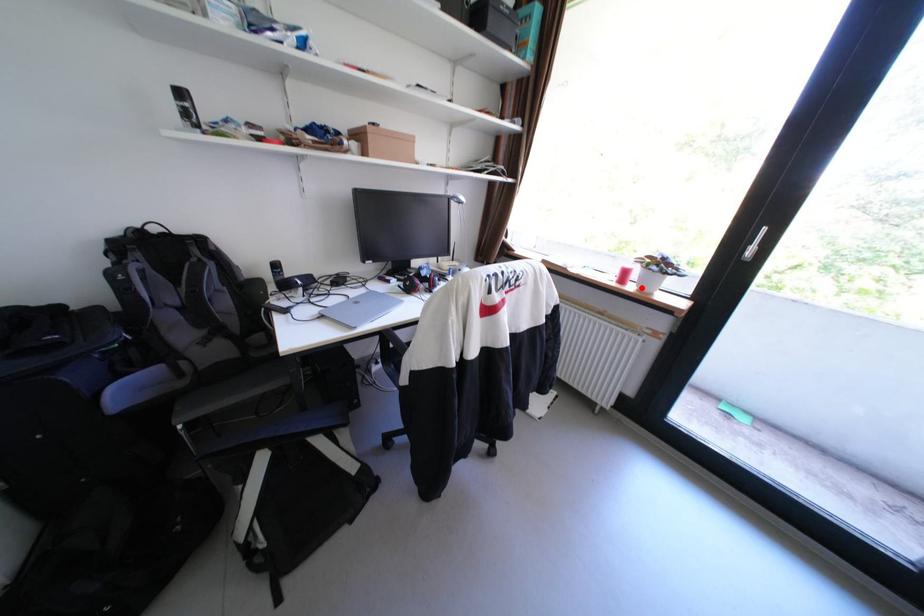
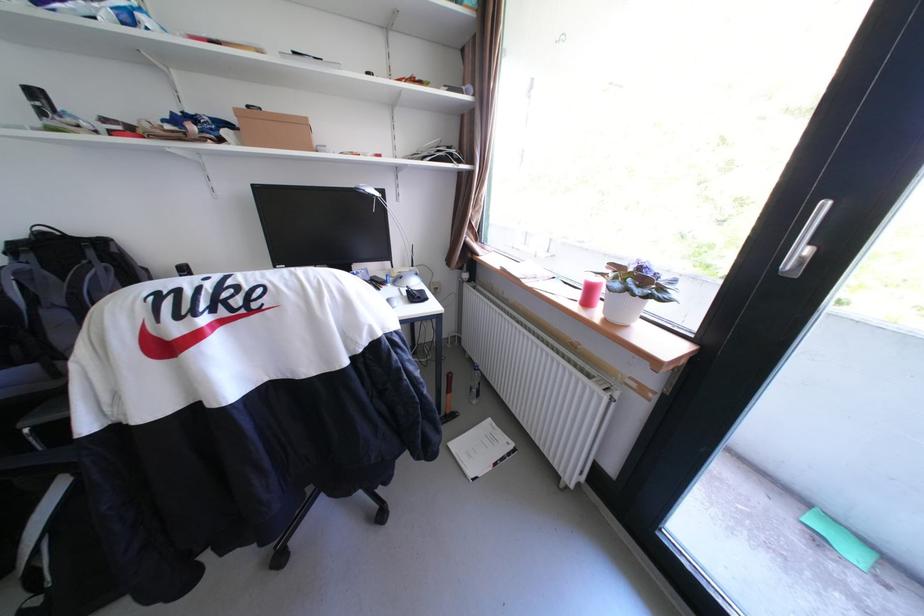
Find the pixel in the second image that matches the highlighted location in the first image.

(608, 313)